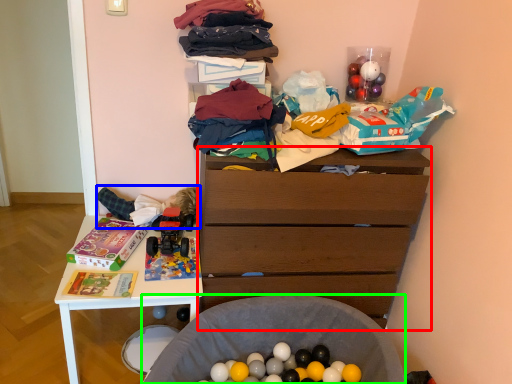
Question: Estimate the real-world distances between objects in this image. Which object is farther from chest of drawers (highlighted by a red box), child (highlighted by a blue box) or waste (highlighted by a green box)?

Choices:
 (A) child
 (B) waste

Answer: (A)